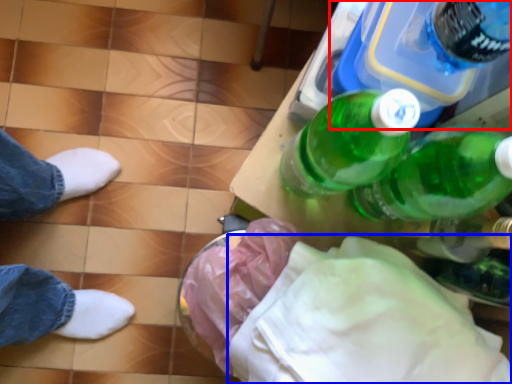
Question: Which object appears closest to the camera in this image, bottle (highlighted by a red box) or cloth (highlighted by a blue box)?

Choices:
 (A) bottle
 (B) cloth

Answer: (B)